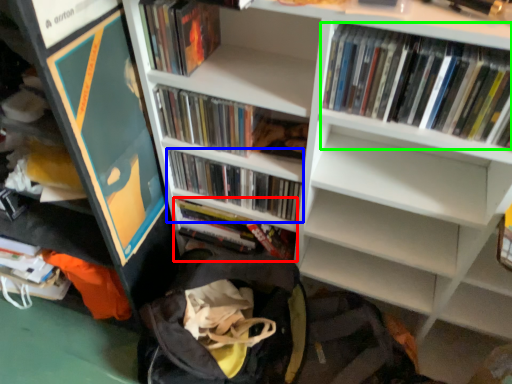
Question: Which object is the farthest from book (highlighted by a red box)? Choose among these: book (highlighted by a blue box) or book (highlighted by a green box).

Choices:
 (A) book
 (B) book

Answer: (B)